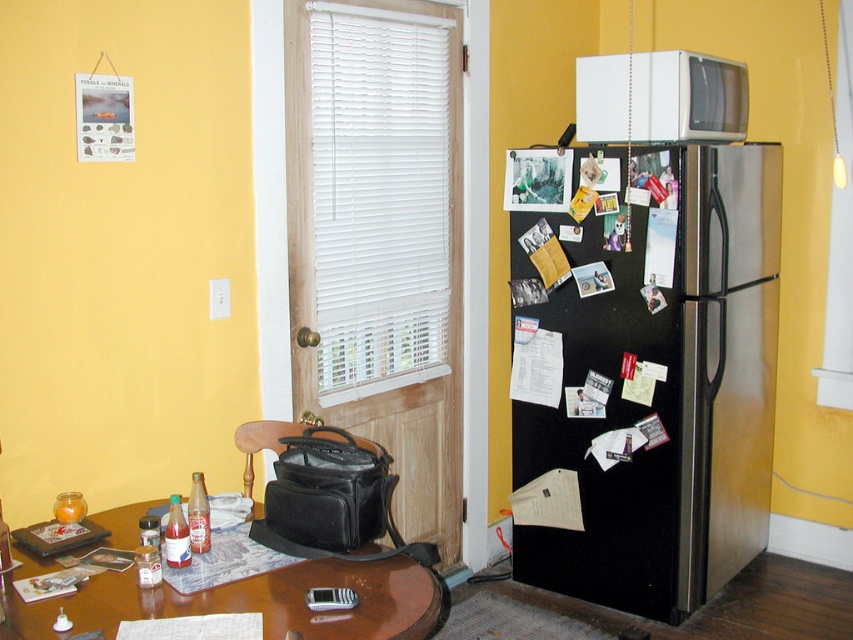
What are the coordinates of the brown glossy table at lower left?

The brown glossy table at lower left is located at point (239,600).

You are organizing the kitchen and need to move items from the brown glossy table at lower left to the black matte refrigerator at right. Which direction should you move the items?

You should move the items to the right, as the black matte refrigerator at right is located to the right of the brown glossy table at lower left.

You are standing in the kitchen and want to reach the point at coordinates point (6, 600). If your arm can extend 1.5 meters, can you reach it?

The distance between point (6, 600) and the camera is 1.55 meters, so you cannot reach it since your arm can only extend 1.5 meters.